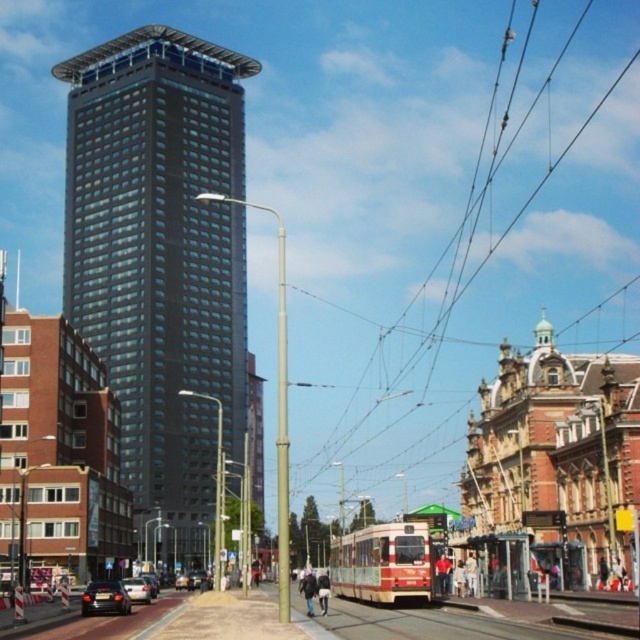
You are standing on the street in front of the matte glass tower at center. You want to take a photo of the tower with your smartphone, but you need to be at least 500 feet away to capture the entire structure in one frame. Can you take the photo from your current position?

The matte glass tower at center is 521.55 feet from viewer, so yes, you can take the photo from your current position because you are far enough away to capture the entire structure in one frame.

In the scene shown: You are a pedestrian standing at the shiny black car at lower left. Looking towards the matte glass tower at center, which direction should you face to see it?

The matte glass tower at center is above the shiny black car at lower left, so you should look upward to see it.

You are standing at the tram stop and want to cross the street to reach the building on the left. Is there a shiny black car at lower left blocking your path?

The shiny black car at lower left is located at point [104,598], so it is positioned near the lower left corner of the frame. Since you are at the tram stop and want to cross to the building on the left, the car is likely not directly blocking your path as it is positioned away from the center of the road.